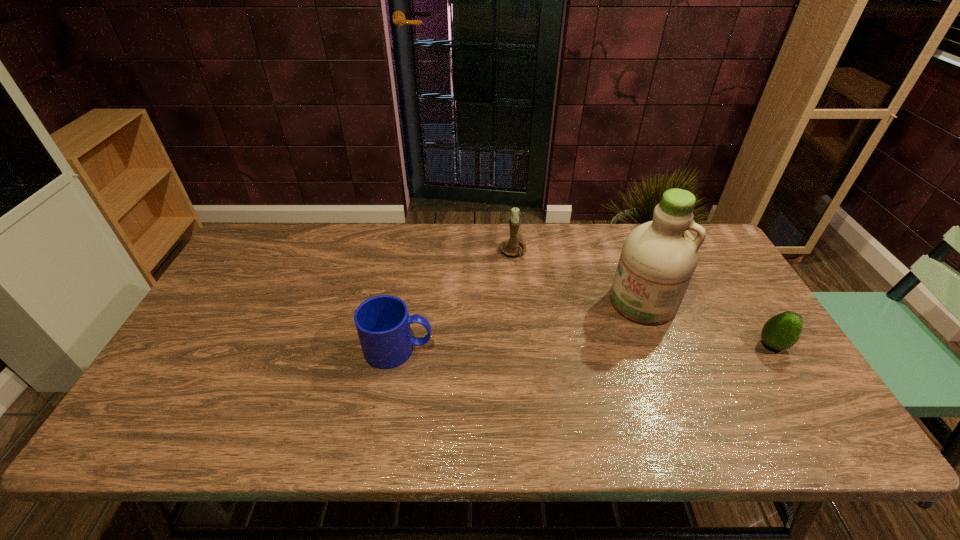
Find the location of `mug`. mug is located at coordinates (383, 323).

Identify the location of the rightmost object. (782, 331).

I want to click on candle holder, so tap(511, 247).

Where is `the second tallest object`? the second tallest object is located at coordinates (511, 247).

What are the coordinates of `the tallest object` in the screenshot? It's located at tap(658, 258).

In order to click on the third nearest object in this screenshot , I will do `click(658, 258)`.

Locate an element on the screen. The height and width of the screenshot is (540, 960). vacant space located 0.330m on the side with the handle of the mug is located at coordinates (561, 349).

Identify the location of free location located 0.070m on the back of the avocado. The image size is (960, 540). (753, 314).

The height and width of the screenshot is (540, 960). I want to click on vacant point located on the side of the candle holder with the handle, so pos(536,307).

Where is `free space located on the side of the candle holder with the handle`? Image resolution: width=960 pixels, height=540 pixels. free space located on the side of the candle holder with the handle is located at coordinates (537, 309).